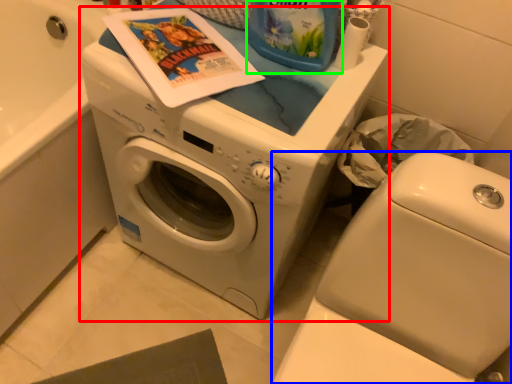
Question: Estimate the real-world distances between objects in this image. Which object is farther from washing machine (highlighted by a red box), washer (highlighted by a blue box) or cleaning product (highlighted by a green box)?

Choices:
 (A) washer
 (B) cleaning product

Answer: (B)